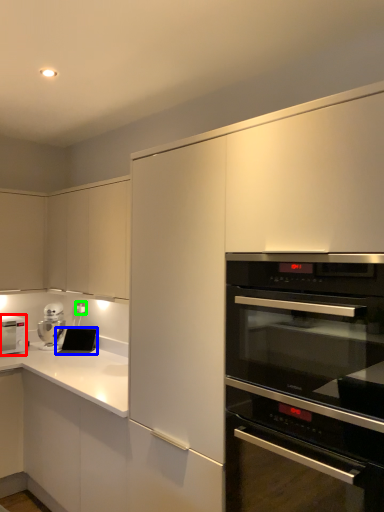
Question: Which object is the farthest from home appliance (highlighted by a red box)? Choose among these: appliance (highlighted by a blue box) or electric outlet (highlighted by a green box).

Choices:
 (A) appliance
 (B) electric outlet

Answer: (B)